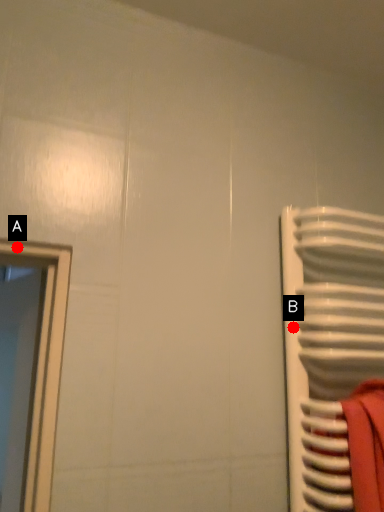
Question: Two points are circled on the image, labeled by A and B beside each circle. Which point appears closest to the camera in this image?

Choices:
 (A) A is closer
 (B) B is closer

Answer: (A)